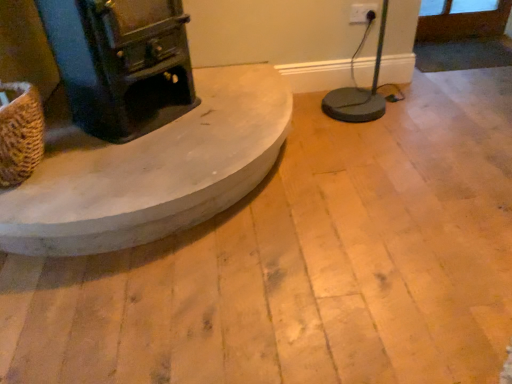
Question: Should I look upward or downward to see smooth concrete hearth at center?

Choices:
 (A) down
 (B) up

Answer: (B)

Question: From the image's perspective, is white plastic electric outlet at upper right beneath smooth concrete hearth at center?

Choices:
 (A) no
 (B) yes

Answer: (A)

Question: Is smooth concrete hearth at center surrounded by white plastic electric outlet at upper right?

Choices:
 (A) no
 (B) yes

Answer: (A)

Question: Is white plastic electric outlet at upper right facing away from smooth concrete hearth at center?

Choices:
 (A) yes
 (B) no

Answer: (B)

Question: From a real-world perspective, does white plastic electric outlet at upper right stand above smooth concrete hearth at center?

Choices:
 (A) yes
 (B) no

Answer: (A)

Question: Considering the relative positions of white plastic electric outlet at upper right and smooth concrete hearth at center in the image provided, is white plastic electric outlet at upper right in front of smooth concrete hearth at center?

Choices:
 (A) no
 (B) yes

Answer: (A)

Question: Can you confirm if white plastic electric outlet at upper right is bigger than smooth concrete hearth at center?

Choices:
 (A) yes
 (B) no

Answer: (B)

Question: Is brown woven basket at left positioned beyond the bounds of smooth concrete hearth at center?

Choices:
 (A) yes
 (B) no

Answer: (A)

Question: Is smooth concrete hearth at center surrounded by brown woven basket at left?

Choices:
 (A) no
 (B) yes

Answer: (A)

Question: Is brown woven basket at left at the right side of smooth concrete hearth at center?

Choices:
 (A) yes
 (B) no

Answer: (B)

Question: Does brown woven basket at left lie behind smooth concrete hearth at center?

Choices:
 (A) yes
 (B) no

Answer: (B)

Question: From the image's perspective, is brown woven basket at left under smooth concrete hearth at center?

Choices:
 (A) no
 (B) yes

Answer: (A)

Question: Is there a large distance between brown woven basket at left and smooth concrete hearth at center?

Choices:
 (A) yes
 (B) no

Answer: (B)

Question: Is smooth concrete hearth at center smaller than brown woven basket at left?

Choices:
 (A) yes
 (B) no

Answer: (B)